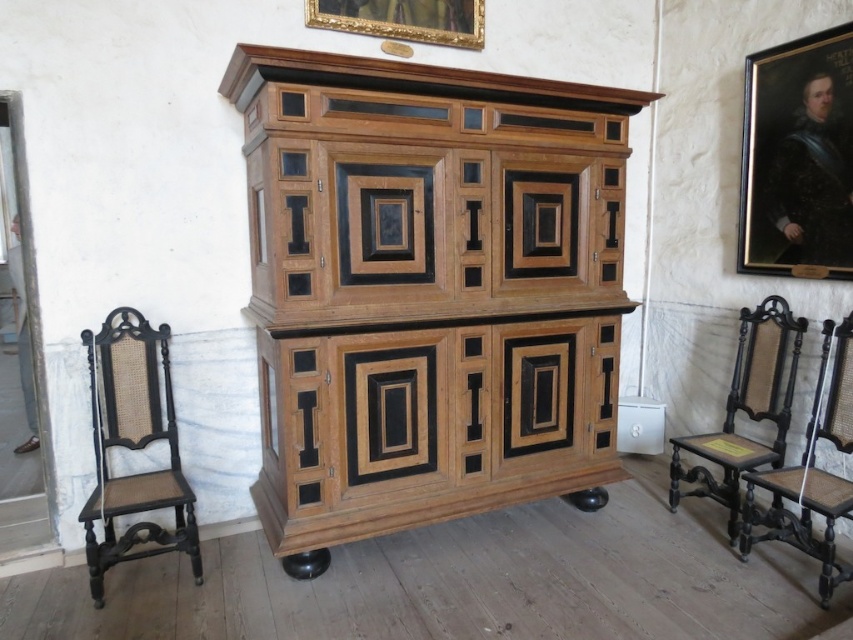
You are standing in the room and want to place a small plant pot at point (746, 410). What object is located at that coordinate?

The point (746, 410) corresponds to the dark wood chair at right.

You are arranging a small event in this room and need to place a 1.5 meter long table between the two black wood chairs. Based on their sizes, will there be enough space between the black wood chair at left and the black wood chair at right to fit the table?

The black wood chair at left occupies less space than the black wood chair at right, so the total space between them may vary. However, since the table is 1.5 meters long, it depends on the actual distance between the chairs. The description only mentions their individual space occupation, not the distance between them. Therefore, we cannot confirm if the table will fit based on the provided information.

In the scene shown: You are standing in front of the wooden cabinet and see two black wood chairs. Which chair is closer to you, the black wood chair at left or the black wood chair at right?

The black wood chair at left is closer to you because it is further to the viewer than the black wood chair at right.